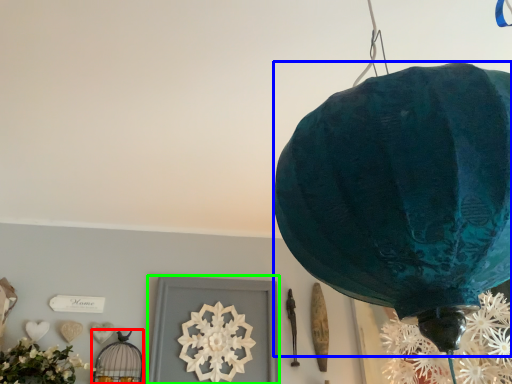
Question: Which object is the closest to the lamp (highlighted by a red box)? Choose among these: lantern (highlighted by a blue box) or picture frame (highlighted by a green box).

Choices:
 (A) lantern
 (B) picture frame

Answer: (B)